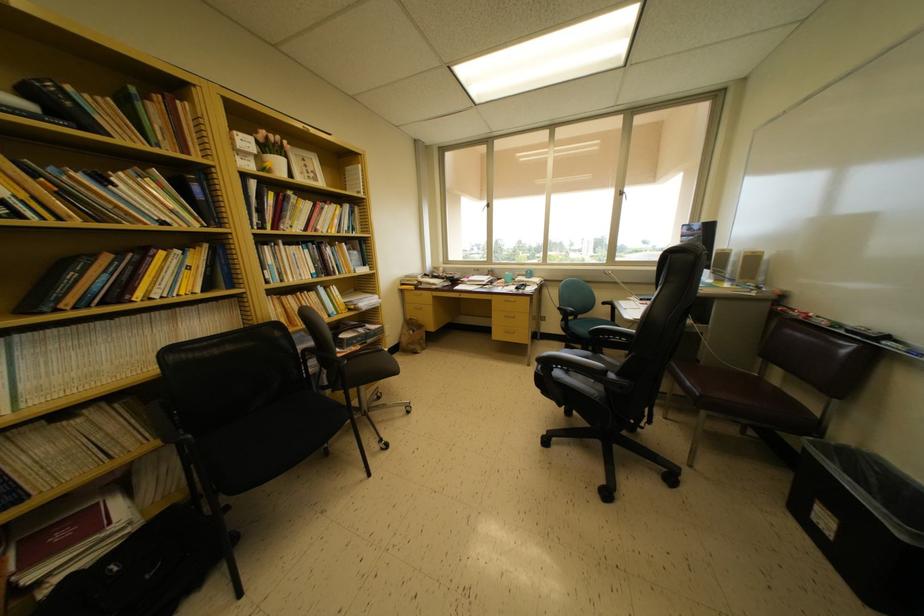
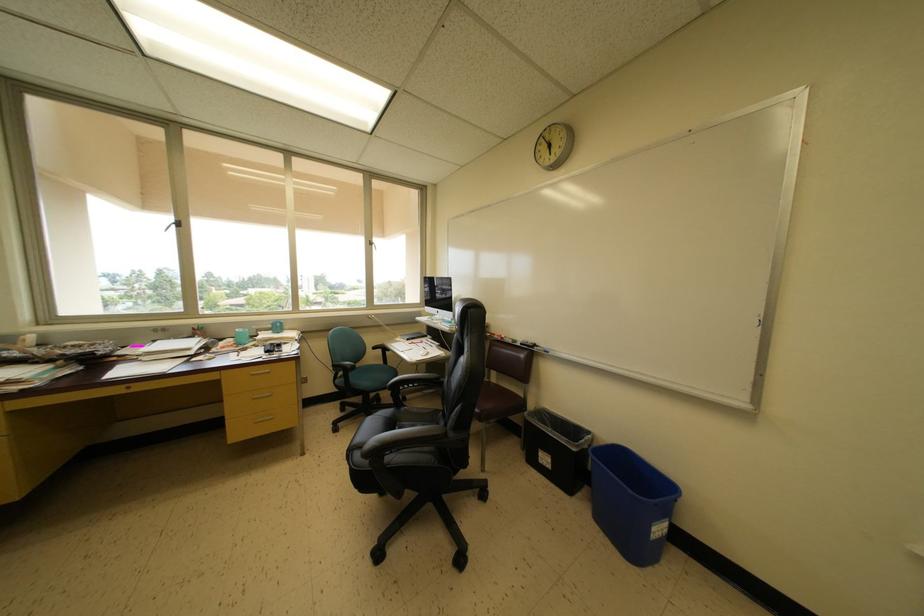
Locate, in the second image, the point that corresponds to (704,399) in the first image.

(485, 416)